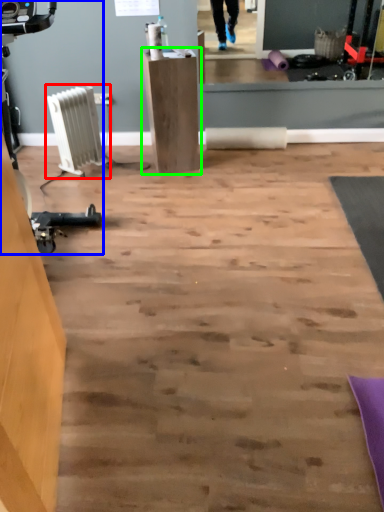
Question: Which is farther away from radiator (highlighted by a red box)? sport equipment (highlighted by a blue box) or furniture (highlighted by a green box)?

Choices:
 (A) sport equipment
 (B) furniture

Answer: (A)